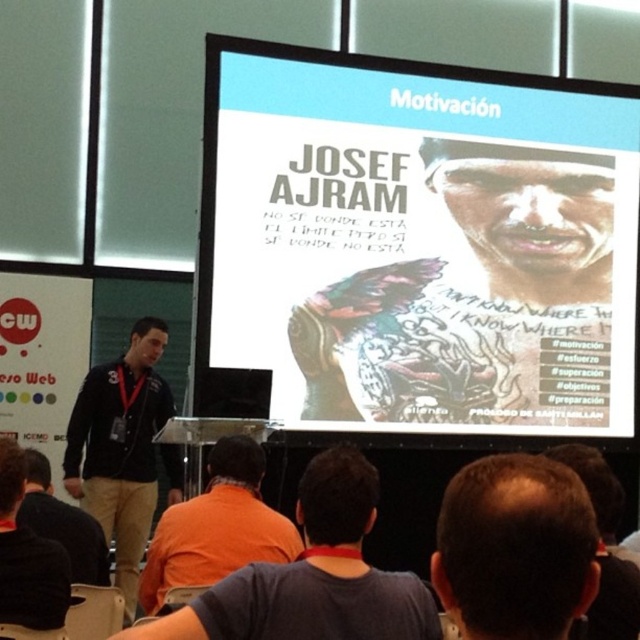
The height and width of the screenshot is (640, 640). What do you see at coordinates (515, 548) in the screenshot? I see `dark brown hair at upper center` at bounding box center [515, 548].

Identify the location of dark brown hair at upper center. (515, 548).

Is point (580, 515) positioned before point (188, 529)?

Yes, it is in front of point (188, 529).

The height and width of the screenshot is (640, 640). In order to click on dark brown hair at upper center in this screenshot , I will do (x=515, y=548).

Between point (237, 387) and point (13, 451), which one is positioned behind?

The point (237, 387) is behind.

Is point (426, 109) more distant than point (4, 504)?

Yes.

At what (x,y) coordinates should I click in order to perform the action: click on white glossy projection screen at upper center. Please return your answer as a coordinate pair (x, y). This screenshot has height=640, width=640. Looking at the image, I should click on (417, 244).

Between orange fabric shirt at lower center and black fabric jacket at left, which one has less height?

orange fabric shirt at lower center

Does orange fabric shirt at lower center have a greater height compared to black fabric jacket at left?

In fact, orange fabric shirt at lower center may be shorter than black fabric jacket at left.

Image resolution: width=640 pixels, height=640 pixels. I want to click on orange fabric shirt at lower center, so click(x=314, y=576).